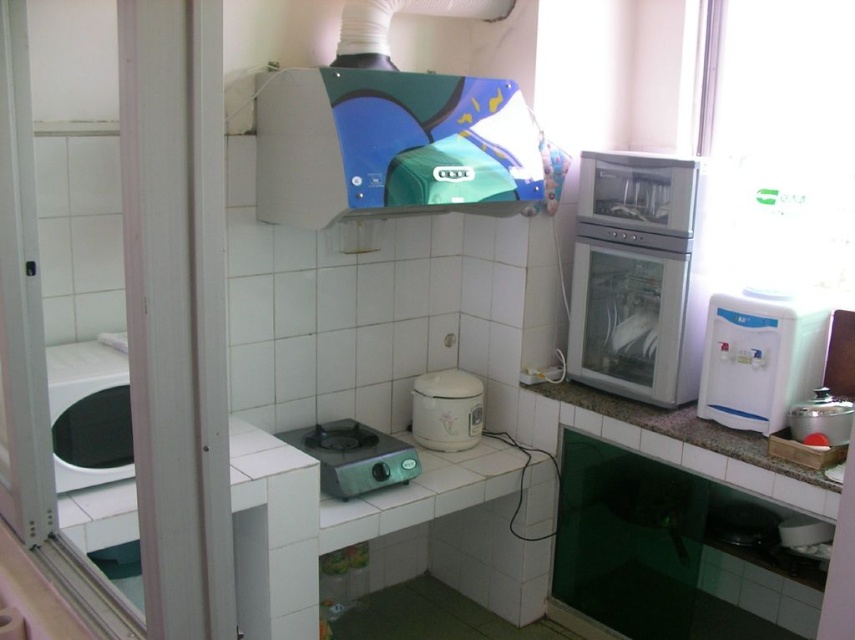
Question: Which point is closer to the camera?

Choices:
 (A) blue glossy exhaust hood at upper center
 (B) green matte electric stove at center

Answer: (A)

Question: Which point is closer to the camera?

Choices:
 (A) (817, 436)
 (B) (747, 328)
 (C) (346, 451)

Answer: (A)

Question: Can you confirm if black glossy washing machine at left is smaller than white glossy countertop at right?

Choices:
 (A) no
 (B) yes

Answer: (B)

Question: Can you confirm if white matte rice cooker at center is positioned to the left of metallic silver pot at lower right?

Choices:
 (A) no
 (B) yes

Answer: (B)

Question: Can you confirm if black glossy washing machine at left is thinner than green matte electric stove at center?

Choices:
 (A) yes
 (B) no

Answer: (A)

Question: Estimate the real-world distances between objects in this image. Which object is closer to the white matte rice cooker at center?

Choices:
 (A) white glossy countertop at right
 (B) blue glossy exhaust hood at upper center
 (C) green matte electric stove at center
 (D) white plastic water dispenser at right

Answer: (C)